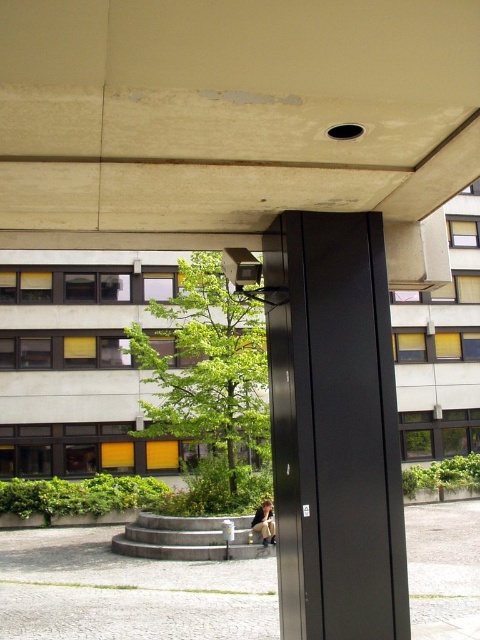
In the scene shown: Who is taller, matte black pillar at center or denim jacket at lower center?

matte black pillar at center

Does matte black pillar at center have a lesser width compared to denim jacket at lower center?

Incorrect, matte black pillar at center's width is not less than denim jacket at lower center's.

Is point (283, 445) farther from camera compared to point (260, 518)?

No.

This screenshot has height=640, width=480. Identify the location of matte black pillar at center. (334, 429).